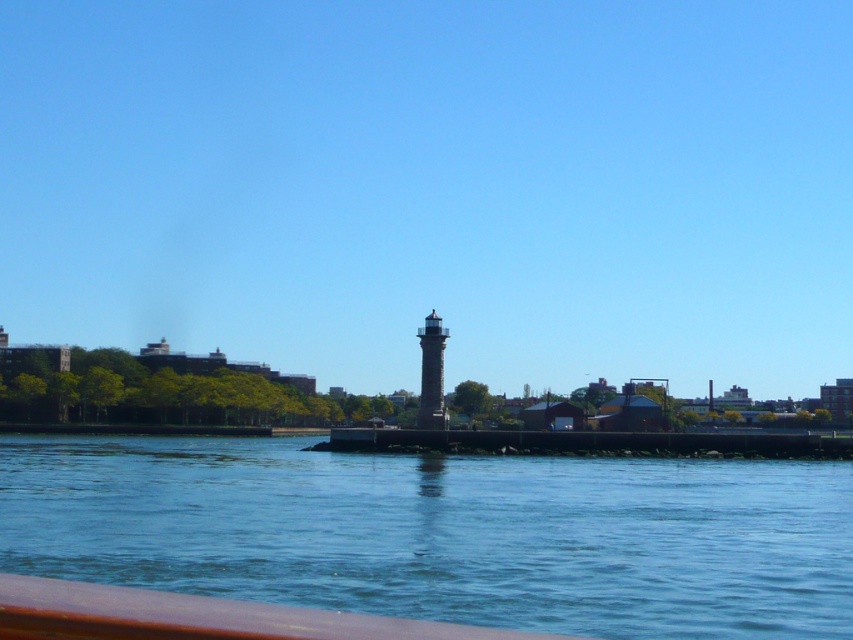
You are standing on a boat looking at the waterfront scene. You see the blue water at center and the gray stone lighthouse at center. Which object is positioned to the left when viewed from your perspective?

The blue water at center is positioned to the left of the gray stone lighthouse at center.

You are standing on a boat and looking at the scene. You see the blue water at center and the gray stone lighthouse at center. Which one appears wider from your perspective?

The blue water at center appears wider than the gray stone lighthouse at center because its width surpasses the lighthouse.

You are standing on a boat looking at the scene. Which object is closer to you between the blue water at center and the gray stone lighthouse at center?

The blue water at center is closer to you because it is located below the gray stone lighthouse at center, meaning the water is in the foreground while the lighthouse is positioned further back.